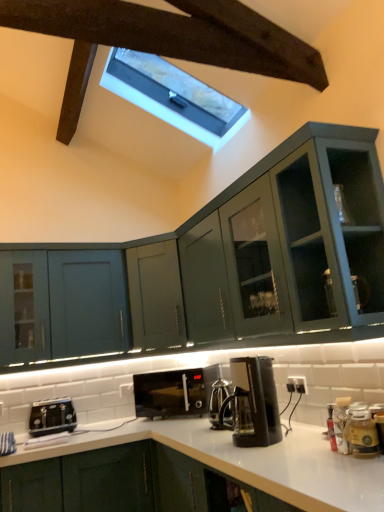
Image resolution: width=384 pixels, height=512 pixels. What do you see at coordinates (61, 304) in the screenshot?
I see `matte green cabinet at left, the 2th cabinetry positioned from the bottom` at bounding box center [61, 304].

What is the approximate width of white marble window at upper center?

It is 38.42 inches.

Find the location of a particular element. The height and width of the screenshot is (512, 384). white marble window at upper center is located at coordinates (174, 96).

What is the approximate height of black matte microwave at center?

The height of black matte microwave at center is 12.86 inches.

Identify the location of black plastic coffee maker at center. (254, 402).

The height and width of the screenshot is (512, 384). Identify the location of black plastic toaster at lower left. (52, 417).

This screenshot has height=512, width=384. In order to click on matte green cabinet at left, which appears as the first cabinetry when viewed from the top in this screenshot , I will do `click(61, 304)`.

The image size is (384, 512). There is a black matte toaster at lower left, arranged as the first cabinetry when ordered from the bottom. Find the location of `toaster above it (from a real-world perspective)`. toaster above it (from a real-world perspective) is located at coordinates (52, 417).

Is black matte toaster at lower left, arranged as the first cabinetry when ordered from the bottom, turned away from black plastic toaster at lower left?

No, black matte toaster at lower left, arranged as the first cabinetry when ordered from the bottom, is not facing away from black plastic toaster at lower left.

Which of these two, black matte toaster at lower left, the second cabinetry from the top, or black plastic toaster at lower left, is thinner?

Thinner between the two is black plastic toaster at lower left.

Is black matte toaster at lower left, arranged as the first cabinetry when ordered from the bottom, inside the boundaries of black plastic toaster at lower left, or outside?

black matte toaster at lower left, arranged as the first cabinetry when ordered from the bottom, cannot be found inside black plastic toaster at lower left.

Is black plastic coffee maker at center far from black plastic toaster at lower left?

black plastic coffee maker at center is positioned a significant distance from black plastic toaster at lower left.

Between black plastic coffee maker at center and black plastic toaster at lower left, which one has larger width?

With larger width is black plastic toaster at lower left.

Is black plastic coffee maker at center at the right side of black plastic toaster at lower left?

Yes.

Considering the sizes of objects black plastic coffee maker at center and black plastic toaster at lower left in the image provided, who is smaller, black plastic coffee maker at center or black plastic toaster at lower left?

black plastic toaster at lower left is smaller.

Considering the points (32, 405) and (236, 373), which point is behind, point (32, 405) or point (236, 373)?

The point (32, 405) is farther.

Is black plastic toaster at lower left inside the boundaries of black plastic coffee maker at center, or outside?

black plastic toaster at lower left is outside black plastic coffee maker at center.

Is black plastic toaster at lower left not close to black plastic coffee maker at center?

Absolutely, black plastic toaster at lower left is distant from black plastic coffee maker at center.

From a real-world perspective, is black plastic toaster at lower left above or below black plastic coffee maker at center?

In terms of real-world spatial position, black plastic toaster at lower left is below black plastic coffee maker at center.

Is point (272, 406) positioned behind point (364, 421)?

Yes, it is behind point (364, 421).

Which is in front, black plastic coffee maker at center or translucent glass jar at lower right?

translucent glass jar at lower right is in front.

Between black plastic coffee maker at center and translucent glass jar at lower right, which one appears on the left side from the viewer's perspective?

black plastic coffee maker at center.

Is white marble window at upper center behind black matte toaster at lower left, arranged as the first cabinetry when ordered from the bottom?

Yes, the depth of white marble window at upper center is greater than that of black matte toaster at lower left, arranged as the first cabinetry when ordered from the bottom.

Find the location of a particular element. The width and height of the screenshot is (384, 512). cabinetry lying in front of the white marble window at upper center is located at coordinates (127, 483).

Is point (116, 79) more distant than point (147, 495)?

Yes, point (116, 79) is behind point (147, 495).

Which object is wider, black plastic toaster at lower left or black matte microwave at center?

With larger width is black matte microwave at center.

From the image's perspective, which one is positioned higher, black plastic toaster at lower left or black matte microwave at center?

From the image's view, black matte microwave at center is above.

Is black matte microwave at center surrounded by black plastic toaster at lower left?

No, black matte microwave at center is not surrounded by black plastic toaster at lower left.

Between black plastic toaster at lower left and translucent glass jar at lower right, which one has larger size?

black plastic toaster at lower left.

From a real-world perspective, which is physically below, black plastic toaster at lower left or translucent glass jar at lower right?

translucent glass jar at lower right.

Does point (47, 408) come in front of point (367, 433)?

No.

Does black plastic toaster at lower left have a lesser width compared to translucent glass jar at lower right?

In fact, black plastic toaster at lower left might be wider than translucent glass jar at lower right.

The height and width of the screenshot is (512, 384). I want to click on toaster lying behind the black matte toaster at lower left, the second cabinetry from the top, so point(52,417).

Identify the location of toaster below the black plastic coffee maker at center (from a real-world perspective). The height and width of the screenshot is (512, 384). (52, 417).

Estimate the real-world distances between objects in this image. Which object is closer to black plastic coffee maker at center, translucent glass jar at lower right or black matte toaster at lower left, the second cabinetry from the top?

translucent glass jar at lower right is positioned closer to the anchor black plastic coffee maker at center.

Estimate the real-world distances between objects in this image. Which object is closer to black plastic coffee maker at center, black matte microwave at center or white marble window at upper center?

black matte microwave at center.

When comparing their distances from black matte microwave at center, does black matte toaster at lower left, arranged as the first cabinetry when ordered from the bottom, or black plastic coffee maker at center seem further?

black plastic coffee maker at center.

Based on their spatial positions, is translucent glass jar at lower right or black matte toaster at lower left, arranged as the first cabinetry when ordered from the bottom, closer to white marble window at upper center?

Based on the image, black matte toaster at lower left, arranged as the first cabinetry when ordered from the bottom, appears to be nearer to white marble window at upper center.

Looking at the image, which one is located closer to matte green cabinet at left, which appears as the first cabinetry when viewed from the top, black plastic toaster at lower left or black plastic coffee maker at center?

Based on the image, black plastic toaster at lower left appears to be nearer to matte green cabinet at left, which appears as the first cabinetry when viewed from the top.

When comparing their distances from matte green cabinet at left, which appears as the first cabinetry when viewed from the top, does black plastic toaster at lower left or black matte toaster at lower left, arranged as the first cabinetry when ordered from the bottom, seem further?

black matte toaster at lower left, arranged as the first cabinetry when ordered from the bottom, is positioned further to the anchor matte green cabinet at left, which appears as the first cabinetry when viewed from the top.

Looking at the image, which one is located further to translucent glass jar at lower right, black plastic toaster at lower left or black plastic coffee maker at center?

The object further to translucent glass jar at lower right is black plastic toaster at lower left.

Estimate the real-world distances between objects in this image. Which object is further from black plastic coffee maker at center, white marble window at upper center or black matte toaster at lower left, the second cabinetry from the top?

white marble window at upper center is further to black plastic coffee maker at center.

Where is `kitchen appliance between white marble window at upper center and black matte microwave at center in the up-down direction`? The width and height of the screenshot is (384, 512). kitchen appliance between white marble window at upper center and black matte microwave at center in the up-down direction is located at coordinates (254, 402).

At what (x,y) coordinates should I click in order to perform the action: click on appliance that lies between white marble window at upper center and black matte microwave at center from top to bottom. Please return your answer as a coordinate pair (x, y). The height and width of the screenshot is (512, 384). Looking at the image, I should click on (361, 430).

Where is `appliance that lies between white marble window at upper center and black matte toaster at lower left, the second cabinetry from the top, from top to bottom`? The width and height of the screenshot is (384, 512). appliance that lies between white marble window at upper center and black matte toaster at lower left, the second cabinetry from the top, from top to bottom is located at coordinates (361, 430).

At what (x,y) coordinates should I click in order to perform the action: click on home appliance between black plastic toaster at lower left and black plastic coffee maker at center. Please return your answer as a coordinate pair (x, y). Image resolution: width=384 pixels, height=512 pixels. Looking at the image, I should click on [x=174, y=392].